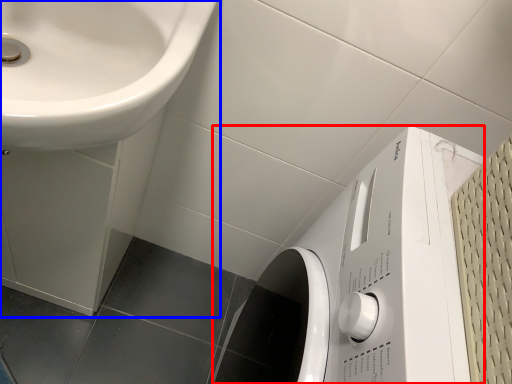
Question: Which object appears closest to the camera in this image, washing machine (highlighted by a red box) or sink (highlighted by a blue box)?

Choices:
 (A) washing machine
 (B) sink

Answer: (A)